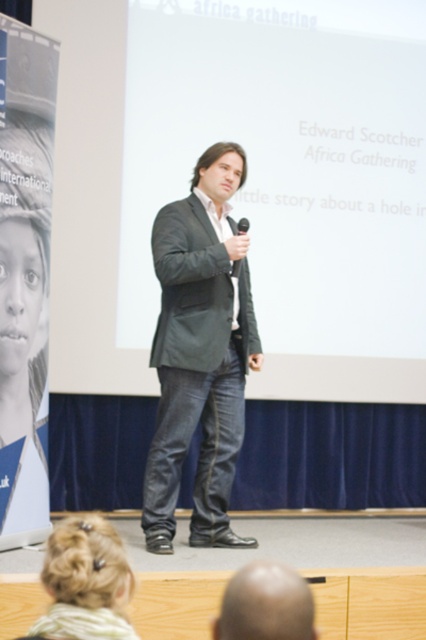
What are the coordinates of the white matte projection screen at center?

The white matte projection screen at center is located at coordinates point (291, 177).

You are an event organizer who needs to ensure the microphone is visible to the audience. Considering the dark gray suit at center and the black matte microphone at center, which object is taller and might block the microphone from view?

The dark gray suit at center is taller than the black matte microphone at center, so it might block the microphone from view.

You are an event organizer who needs to ensure the speaker is visible to the audience. Considering the dark gray suit at center and the black matte microphone at center, which object is wider and might block the audience from seeing the speaker?

The dark gray suit at center is wider than the black matte microphone at center, so it might block the audience from seeing the speaker.